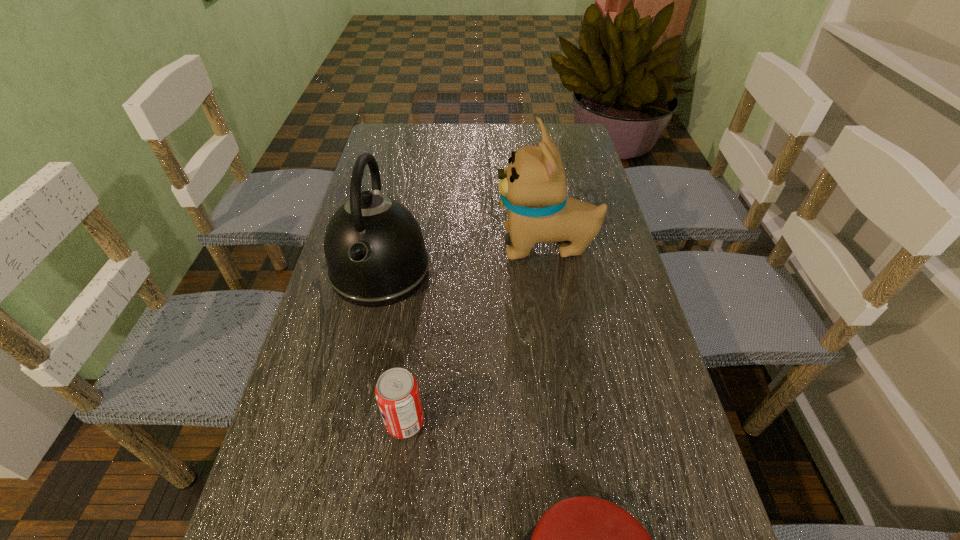
Identify which object is located as the second nearest to the kettle. Please provide its 2D coordinates. Your answer should be formatted as a tuple, i.e. [(x, y)], where the tuple contains the x and y coordinates of a point satisfying the conditions above.

[(397, 393)]

Locate which object ranks in proximity to the kettle. Please provide its 2D coordinates. Your answer should be formatted as a tuple, i.e. [(x, y)], where the tuple contains the x and y coordinates of a point satisfying the conditions above.

[(533, 188)]

I want to click on free space in the image that satisfies the following two spatial constraints: 1. on the face of the puppy; 2. on the spout of the kettle, so click(x=551, y=269).

Where is `vacant space that satisfies the following two spatial constraints: 1. on the spout of the kettle; 2. on the right side of the soda can`? This screenshot has height=540, width=960. vacant space that satisfies the following two spatial constraints: 1. on the spout of the kettle; 2. on the right side of the soda can is located at coordinates (347, 423).

This screenshot has width=960, height=540. In order to click on free space that satisfies the following two spatial constraints: 1. on the face of the puppy; 2. on the spout of the kettle in this screenshot , I will do `click(551, 269)`.

Where is `free point that satisfies the following two spatial constraints: 1. on the face of the puppy; 2. on the spout of the kettle`? free point that satisfies the following two spatial constraints: 1. on the face of the puppy; 2. on the spout of the kettle is located at coordinates (551, 269).

Locate an element on the screen. The height and width of the screenshot is (540, 960). vacant area that satisfies the following two spatial constraints: 1. on the face of the puppy; 2. on the spout of the kettle is located at coordinates (551, 269).